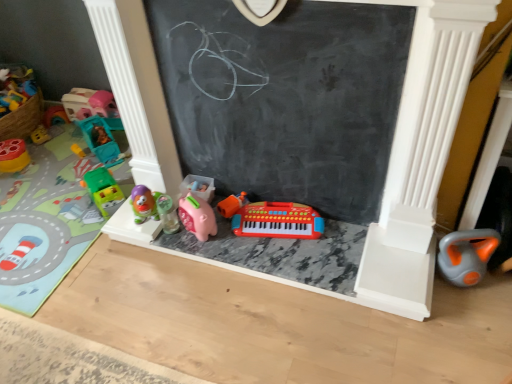
Question: From the image's perspective, is translucent plastic toy car at left, which is the fourth toy in left-to-right order, above or below green plastic toy car at left, positioned as the second toy in left-to-right order?

Choices:
 (A) above
 (B) below

Answer: (A)

Question: Do you think translucent plastic toy car at left, positioned as the fifth toy in right-to-left order, is within green plastic toy car at left, positioned as the second toy in left-to-right order, or outside of it?

Choices:
 (A) outside
 (B) inside

Answer: (A)

Question: Which is farther from the translucent plastic toy at center, the sixth toy in the left-to-right sequence?

Choices:
 (A) green plastic toy car at left, positioned as the second toy in left-to-right order
 (B) green plastic toy car at left, the 5th toy in the left-to-right sequence
 (C) orange rubber toy at lower right, the 8th toy in the left-to-right sequence
 (D) pink rubber piggy bank at center, the seventh toy from the left
 (E) matte yellow and red toy at left, arranged as the 8th toy when viewed from the right

Answer: (C)

Question: Estimate the real-world distances between objects in this image. Which object is farther from the translucent plastic toy at center, acting as the third toy starting from the right?

Choices:
 (A) orange rubber toy at lower right, the 8th toy in the left-to-right sequence
 (B) green plastic toy car at left, which is the 4th toy from right to left
 (C) translucent plastic toy car at left, which is the fourth toy in left-to-right order
 (D) translucent plastic car at upper left, which is counted as the 3th toy, starting from the left
 (E) matte yellow and red toy at left, the 1th toy from the left

Answer: (A)